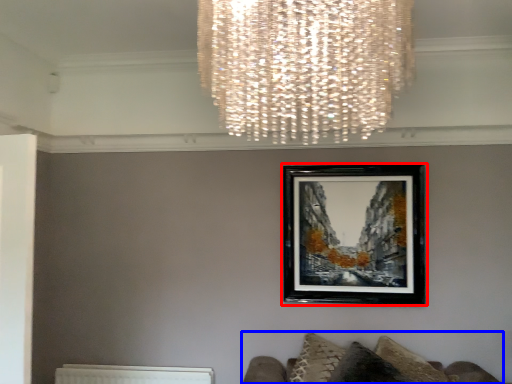
Question: Which point is further to the camera, picture frame (highlighted by a red box) or furniture (highlighted by a blue box)?

Choices:
 (A) picture frame
 (B) furniture

Answer: (A)